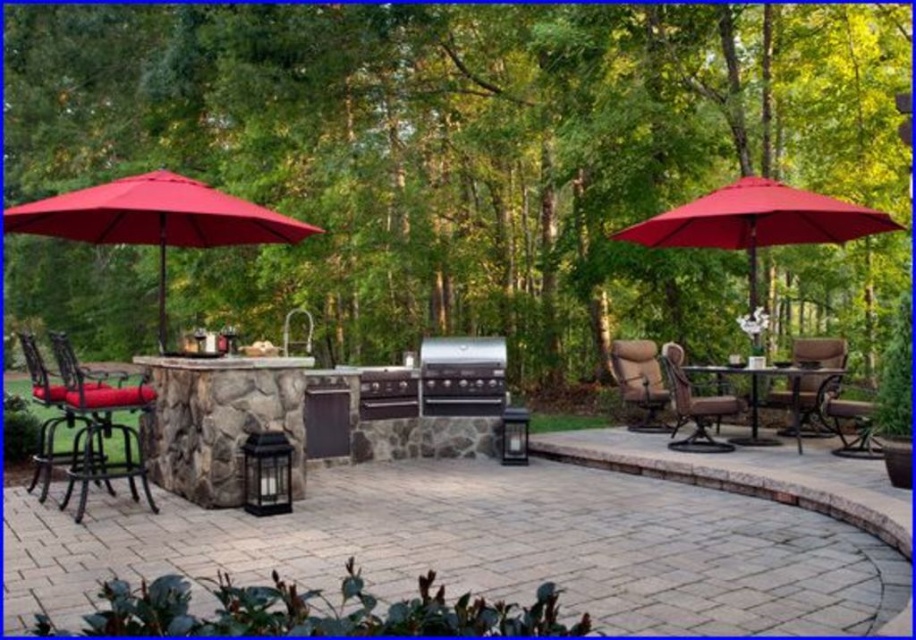
You are planning to sit on the brown woven chair at center. Will the red fabric umbrella at left provide shade for you?

The red fabric umbrella at left is located above the brown woven chair at center, so yes, it will provide shade for you.

You are standing at the center of the patio and want to place a new decorative pot at the exact location where the red fabric umbrella at left is currently positioned. What are the coordinates of that location?

The coordinates of the location where the red fabric umbrella at left is positioned are at point (155, 220).

You are planning to host a barbecue party on the patio. You need to ensure that the grill is accessible for cooking while keeping it under the shade. Is the red fabric umbrella at left positioned in a way that it covers the black stainless steel grill at center?

Yes, the red fabric umbrella at left is positioned over the black stainless steel grill at center, so it provides shade while allowing access for cooking.